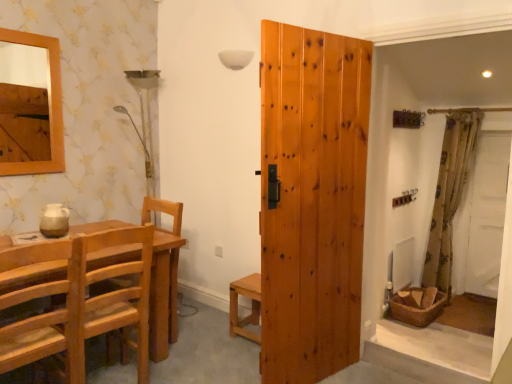
Question: Looking at the image, does natural wood door at center seem bigger or smaller compared to light brown wooden chair at left, the 1th chair when ordered from back to front?

Choices:
 (A) big
 (B) small

Answer: (A)

Question: Is natural wood door at center inside the boundaries of light brown wooden chair at left, the 1th chair when ordered from back to front, or outside?

Choices:
 (A) outside
 (B) inside

Answer: (A)

Question: Estimate the real-world distances between objects in this image. Which object is closer to the natural wood chair at left?

Choices:
 (A) light brown wooden chair at lower left, the 2th chair in the back-to-front sequence
 (B) light brown wooden chair at left, the 1th chair when ordered from back to front
 (C) light brown wooden stool at center
 (D) natural wood door at center
 (E) floral fabric curtain at right

Answer: (C)

Question: Which object is positioned closest to the light brown wooden chair at left, the 1th chair when ordered from back to front?

Choices:
 (A) light brown wooden stool at center
 (B) natural wood door at center
 (C) light brown wooden chair at lower left, the 2th chair in the back-to-front sequence
 (D) natural wood chair at left
 (E) floral fabric curtain at right

Answer: (C)